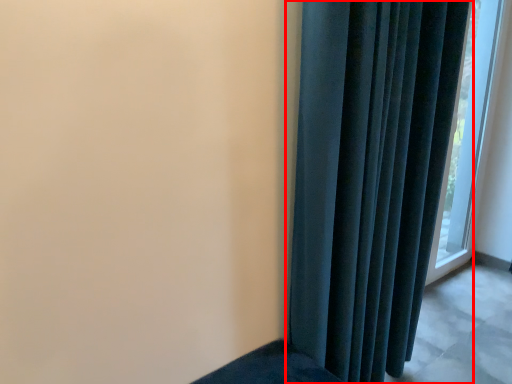
Question: Observing the image, what is the correct spatial positioning of curtain (annotated by the red box) in reference to window?

Choices:
 (A) right
 (B) left

Answer: (B)